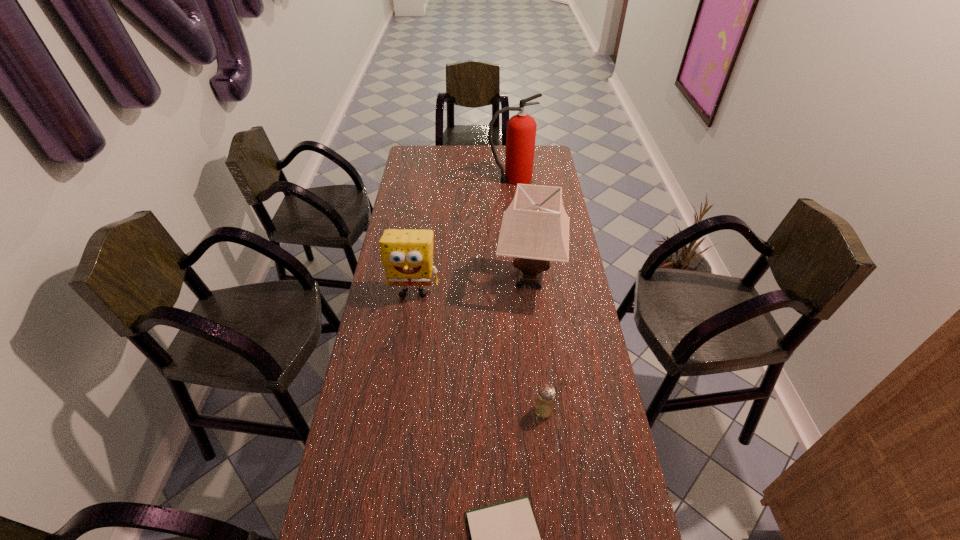
The image size is (960, 540). I want to click on free spot between the leftmost object and the fire extinguisher, so click(x=463, y=235).

Identify the location of the second closest object relative to the leftmost object. (544, 407).

What are the coordinates of `object that is the third closest to the lampshade` in the screenshot? It's located at (521, 128).